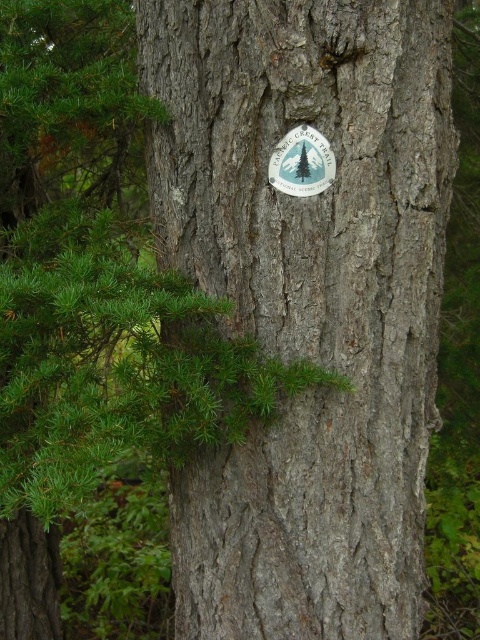
Question: Is gray rough bark tree trunk at center positioned at the back of white matte sticker at center?

Choices:
 (A) no
 (B) yes

Answer: (A)

Question: Does gray rough bark tree trunk at center have a larger size compared to white matte sticker at center?

Choices:
 (A) yes
 (B) no

Answer: (A)

Question: Which of the following is the closest to the observer?

Choices:
 (A) white matte sticker at center
 (B) gray rough bark tree trunk at center

Answer: (B)

Question: Is gray rough bark tree trunk at center below white matte sticker at center?

Choices:
 (A) yes
 (B) no

Answer: (A)